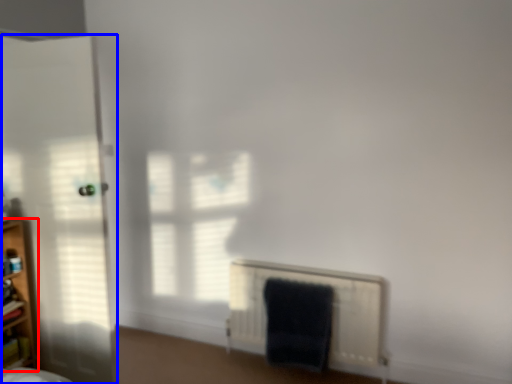
Question: Which of the following is the closest to the observer, shelf (highlighted by a red box) or door (highlighted by a blue box)?

Choices:
 (A) shelf
 (B) door

Answer: (B)